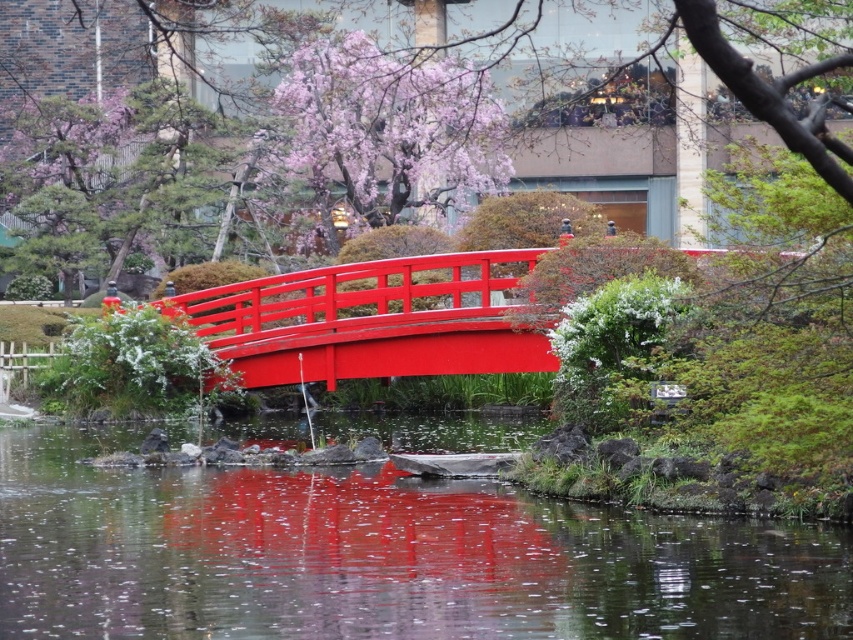
In the scene shown: You are a visitor in the garden and want to cross the glossy wood bridge at center to reach the other side. However, you are concerned about the water beneath it. Is the transparent water at center directly under the bridge?

The transparent water at center is positioned under the glossy wood bridge at center, so yes, the water is directly beneath the bridge.

You are a painter standing at the edge of the pond in the Japanese garden scene. You want to paint the glossy wood bridge at center and the transparent water at center. Which object will appear larger in your painting if you focus on their heights?

The glossy wood bridge at center will appear larger in the painting because it is taller than the transparent water at center.